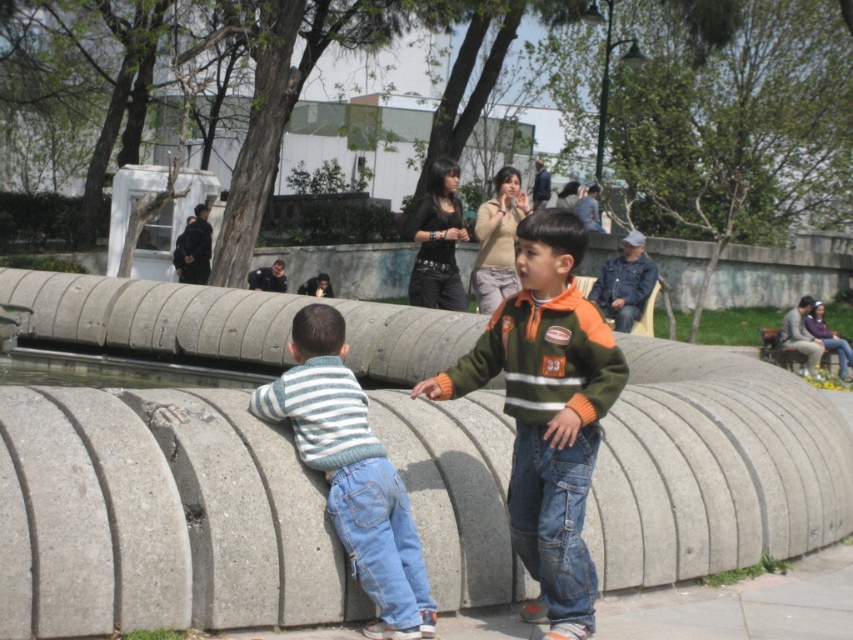
Question: Is orange-green fleece jacket at center above striped knit sweater at left?

Choices:
 (A) no
 (B) yes

Answer: (B)

Question: Is gray concrete at center to the right of orange-green fleece jacket at center from the viewer's perspective?

Choices:
 (A) no
 (B) yes

Answer: (B)

Question: Among these objects, which one is nearest to the camera?

Choices:
 (A) orange-green fleece jacket at center
 (B) striped knit sweater at left
 (C) gray concrete at center

Answer: (A)

Question: Is gray concrete at center to the right of orange-green fleece jacket at center from the viewer's perspective?

Choices:
 (A) no
 (B) yes

Answer: (B)

Question: Considering the real-world distances, which object is farthest from the gray concrete at center?

Choices:
 (A) orange-green fleece jacket at center
 (B) striped knit sweater at left

Answer: (B)

Question: Which of the following is the closest to the observer?

Choices:
 (A) (383, 512)
 (B) (701, 410)

Answer: (A)